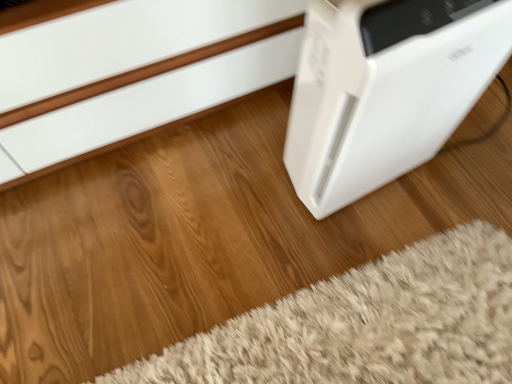
The width and height of the screenshot is (512, 384). Identify the location of white fluffy rug at lower right. (366, 324).

Measure the distance between point (316, 350) and camera.

Point (316, 350) is 35.24 inches away from camera.

What do you see at coordinates (366, 324) in the screenshot? I see `white fluffy rug at lower right` at bounding box center [366, 324].

What is the approximate width of white plastic air purifier at right?

A: 8.25 inches.

This screenshot has width=512, height=384. What do you see at coordinates (385, 90) in the screenshot?
I see `white plastic air purifier at right` at bounding box center [385, 90].

Where is `white plastic air purifier at right`? This screenshot has height=384, width=512. white plastic air purifier at right is located at coordinates (385, 90).

In order to face white plastic air purifier at right, should I rotate leftwards or rightwards?

To face it directly, rotate right by 17.373 degrees.

Where is `white fluffy rug at lower right`? Image resolution: width=512 pixels, height=384 pixels. white fluffy rug at lower right is located at coordinates (366, 324).

Which is more to the left, white fluffy rug at lower right or white plastic air purifier at right?

white fluffy rug at lower right is more to the left.

From the picture: Considering their positions, is white fluffy rug at lower right located in front of or behind white plastic air purifier at right?

white fluffy rug at lower right is positioned farther from the viewer than white plastic air purifier at right.

Which is nearer, (485,324) or (487,54)?

Clearly, point (485,324) is more distant from the camera than point (487,54).

From the image's perspective, who appears lower, white fluffy rug at lower right or white plastic air purifier at right?

white fluffy rug at lower right, from the image's perspective.

From a real-world perspective, which is physically below, white fluffy rug at lower right or white plastic air purifier at right?

white fluffy rug at lower right is physically lower.

Between white fluffy rug at lower right and white plastic air purifier at right, which one has smaller width?

Thinner between the two is white plastic air purifier at right.

Who is taller, white fluffy rug at lower right or white plastic air purifier at right?

white plastic air purifier at right is taller.

Who is smaller, white fluffy rug at lower right or white plastic air purifier at right?

Smaller between the two is white fluffy rug at lower right.

Based on the photo, is white plastic air purifier at right inside white fluffy rug at lower right?

Actually, white plastic air purifier at right is outside white fluffy rug at lower right.

Is the surface of white fluffy rug at lower right in direct contact with white plastic air purifier at right?

white fluffy rug at lower right and white plastic air purifier at right are clearly separated.

Is white fluffy rug at lower right aimed at white plastic air purifier at right?

No, white fluffy rug at lower right is not facing towards white plastic air purifier at right.

How many degrees apart are the facing directions of white fluffy rug at lower right and white plastic air purifier at right?

The angular difference between white fluffy rug at lower right and white plastic air purifier at right is 97.5 degrees.

Measure the distance between white fluffy rug at lower right and white plastic air purifier at right.

white fluffy rug at lower right is 14.51 inches away from white plastic air purifier at right.

Identify the location of home appliance above the white fluffy rug at lower right (from the image's perspective). This screenshot has height=384, width=512. (385, 90).

Considering the relative positions of white plastic air purifier at right and white fluffy rug at lower right in the image provided, is white plastic air purifier at right to the right of white fluffy rug at lower right from the viewer's perspective?

Indeed, white plastic air purifier at right is positioned on the right side of white fluffy rug at lower right.

In the image, is white plastic air purifier at right positioned in front of or behind white fluffy rug at lower right?

Clearly, white plastic air purifier at right is in front of white fluffy rug at lower right.

Does point (414, 28) come closer to viewer compared to point (141, 380)?

Yes.

From the image's perspective, would you say white plastic air purifier at right is positioned over white fluffy rug at lower right?

Yes.

From the picture: From a real-world perspective, relative to white fluffy rug at lower right, is white plastic air purifier at right vertically above or below?

Clearly, from a real-world perspective, white plastic air purifier at right is above white fluffy rug at lower right.

In terms of width, does white plastic air purifier at right look wider or thinner when compared to white fluffy rug at lower right?

In the image, white plastic air purifier at right appears to be more narrow than white fluffy rug at lower right.

Considering the relative sizes of white plastic air purifier at right and white fluffy rug at lower right in the image provided, is white plastic air purifier at right taller than white fluffy rug at lower right?

Yes, white plastic air purifier at right is taller than white fluffy rug at lower right.

Does white plastic air purifier at right have a smaller size compared to white fluffy rug at lower right?

Actually, white plastic air purifier at right might be larger than white fluffy rug at lower right.

Is white plastic air purifier at right situated inside white fluffy rug at lower right or outside?

white plastic air purifier at right is outside white fluffy rug at lower right.

Is white plastic air purifier at right in contact with white fluffy rug at lower right?

white plastic air purifier at right and white fluffy rug at lower right are not in contact.

Is white plastic air purifier at right facing towards white fluffy rug at lower right?

No, white plastic air purifier at right is not facing towards white fluffy rug at lower right.

How much distance is there between white plastic air purifier at right and white fluffy rug at lower right?

white plastic air purifier at right and white fluffy rug at lower right are 14.51 inches apart from each other.

The image size is (512, 384). I want to click on doormat behind the white plastic air purifier at right, so click(x=366, y=324).

You are a GUI agent. You are given a task and a screenshot of the screen. Output one action in this format:
    pyautogui.click(x=<x>, y=<y>)
    Task: Click on the home appliance above the white fluffy rug at lower right (from the image's perspective)
    The image size is (512, 384).
    Given the screenshot: What is the action you would take?
    pyautogui.click(x=385, y=90)

Image resolution: width=512 pixels, height=384 pixels. I want to click on home appliance to the right of white fluffy rug at lower right, so click(x=385, y=90).